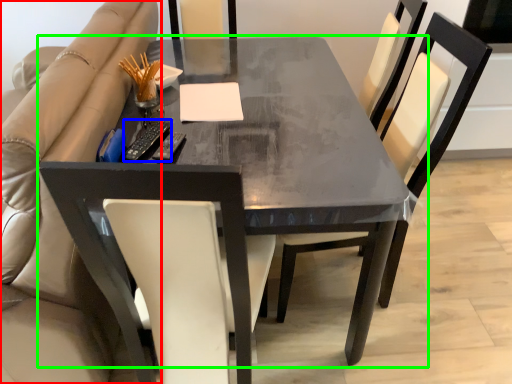
Question: Considering the real-world distances, which object is farthest from beige (highlighted by a red box)? remote (highlighted by a blue box) or table (highlighted by a green box)?

Choices:
 (A) remote
 (B) table

Answer: (B)